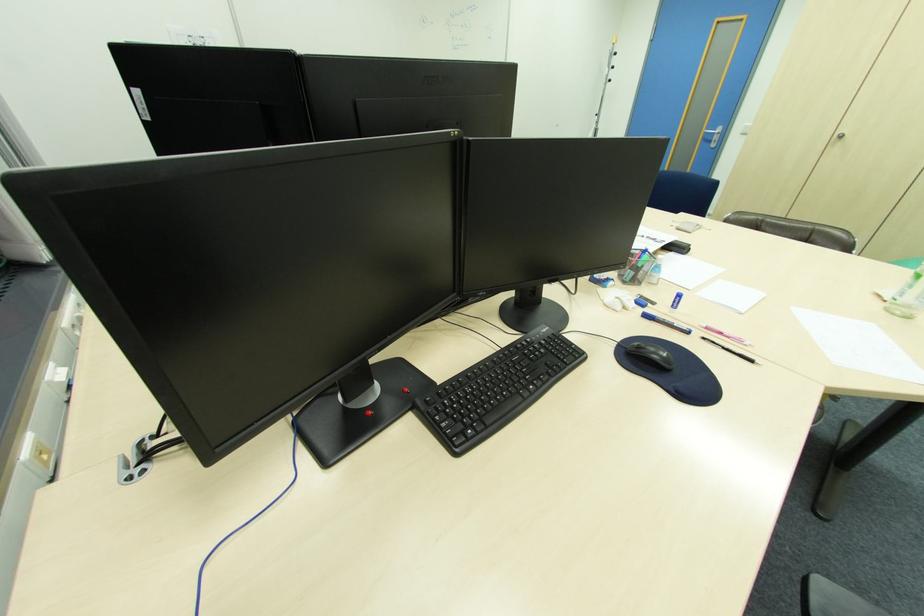
Image resolution: width=924 pixels, height=616 pixels. Identify the location of pink pen. (725, 334).